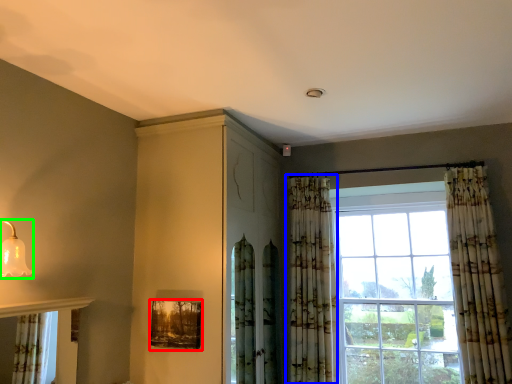
Question: Which object is positioned farthest from picture frame (highlighted by a red box)? Select from curtain (highlighted by a blue box) and light fixture (highlighted by a green box).

Choices:
 (A) curtain
 (B) light fixture

Answer: (A)